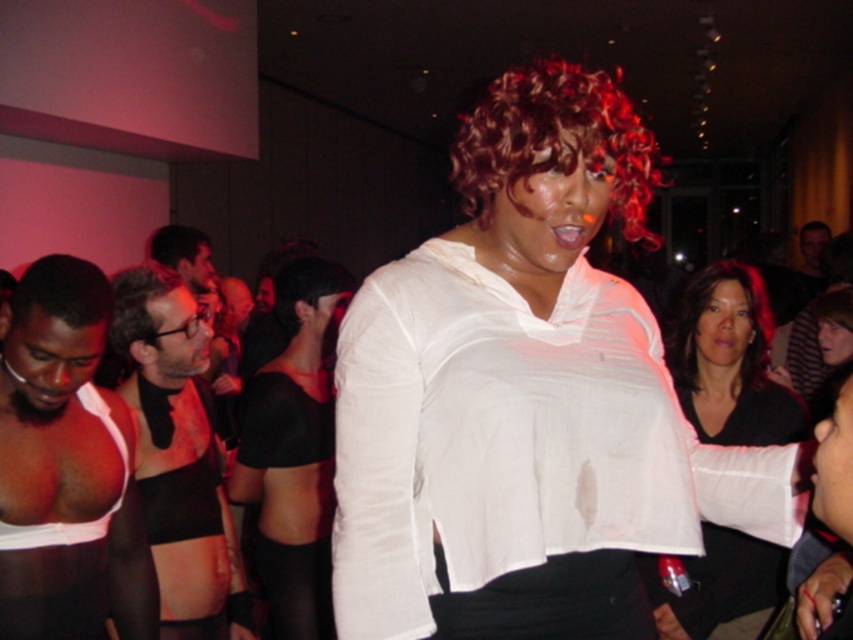
Does white sheer blouse at center have a larger size compared to matte black arm at center?

Correct, white sheer blouse at center is larger in size than matte black arm at center.

Between point (473, 472) and point (769, 442), which one is positioned behind?

Positioned behind is point (769, 442).

At what (x,y) coordinates should I click in order to perform the action: click on white sheer blouse at center. Please return your answer as a coordinate pair (x, y). The height and width of the screenshot is (640, 853). Looking at the image, I should click on (526, 397).

Is black sheer top at center to the right of matte black arm at center from the viewer's perspective?

No, black sheer top at center is not to the right of matte black arm at center.

What do you see at coordinates (293, 451) in the screenshot? Image resolution: width=853 pixels, height=640 pixels. I see `black sheer top at center` at bounding box center [293, 451].

Identify the location of black sheer top at center. (293, 451).

The height and width of the screenshot is (640, 853). What are the coordinates of `black sheer top at center` in the screenshot? It's located at (293, 451).

Who is taller, matte black arm at center or curly brown wig at center?

With more height is curly brown wig at center.

Does matte black arm at center have a greater width compared to curly brown wig at center?

Incorrect, matte black arm at center's width does not surpass curly brown wig at center's.

Which is behind, point (648, 586) or point (457, 138)?

Point (648, 586)

Where is `matte black arm at center`? matte black arm at center is located at coordinates (729, 362).